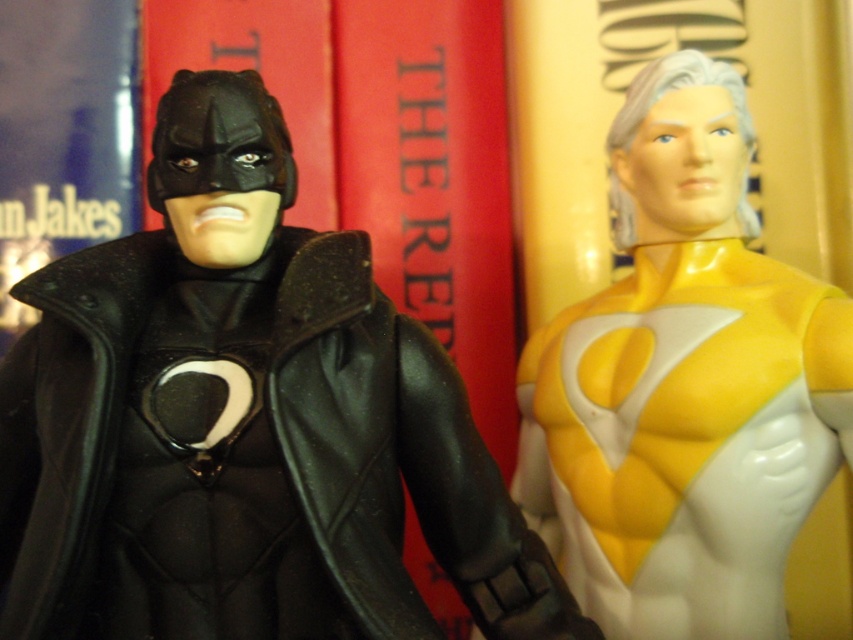
Please provide the 2D coordinates of the matte black suit at left in the image. The coordinates should be in the format of a point with two decimal places, like this example format point format example format point format point format point format point format point format point format point format point format point format point format point format point format point format point format point format point format point format point format point format point format point format point format point format. The

The 2D coordinates of the matte black suit at left are at point (242, 422).